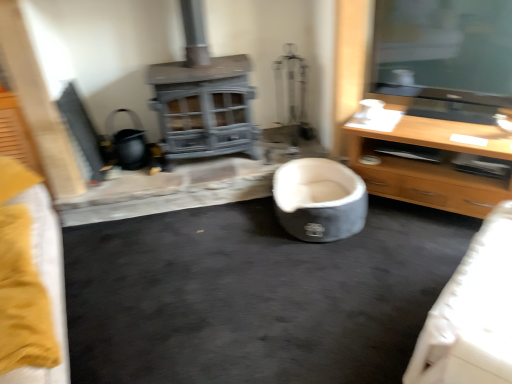
This screenshot has height=384, width=512. Identify the location of vacant area that is in front of light wood/finish tv stand at right. (409, 258).